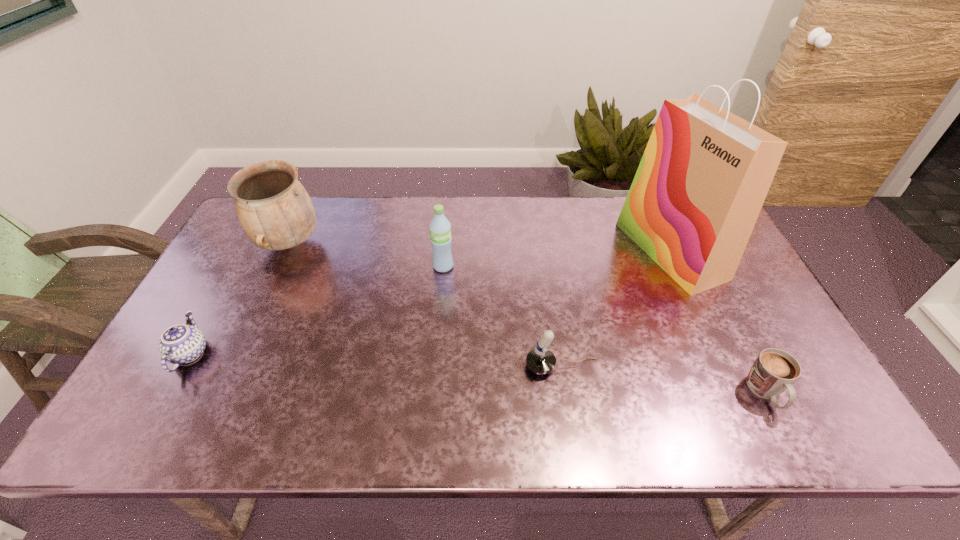
You are a GUI agent. You are given a task and a screenshot of the screen. Output one action in this format:
    pyautogui.click(x=<x>, y=<y>)
    Task: Click on the vacant space that satisfies the following two spatial constraints: 1. on the front side of the shopping bag; 2. at the spout of the chinaware
    
    Given the screenshot: What is the action you would take?
    pyautogui.click(x=717, y=354)

Find the location of `blank area in the image that satisfies the following two spatial constraints: 1. on the front side of the urn; 2. on the right side of the fourth tallest object`. blank area in the image that satisfies the following two spatial constraints: 1. on the front side of the urn; 2. on the right side of the fourth tallest object is located at coordinates (233, 366).

This screenshot has width=960, height=540. Find the location of `vacant space that satisfies the following two spatial constraints: 1. on the back side of the shopping bag; 2. on the right side of the microphone`. vacant space that satisfies the following two spatial constraints: 1. on the back side of the shopping bag; 2. on the right side of the microphone is located at coordinates pos(543,251).